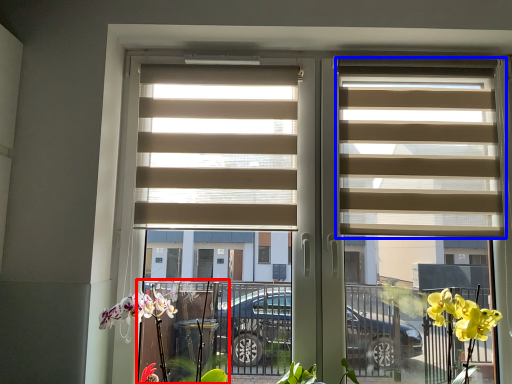
Question: Which object appears farthest to the camera in this image, plant (highlighted by a red box) or window blind (highlighted by a blue box)?

Choices:
 (A) plant
 (B) window blind

Answer: (B)